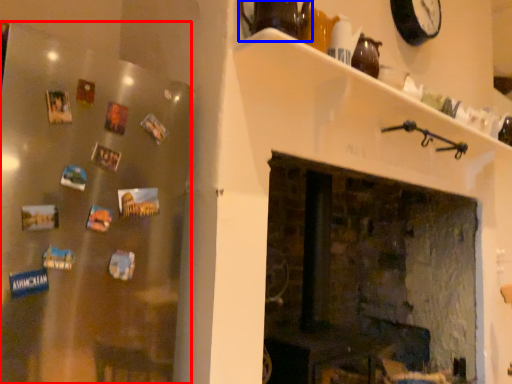
Question: Which object appears closest to the camera in this image, fridge (highlighted by a red box) or tea pot (highlighted by a blue box)?

Choices:
 (A) fridge
 (B) tea pot

Answer: (A)